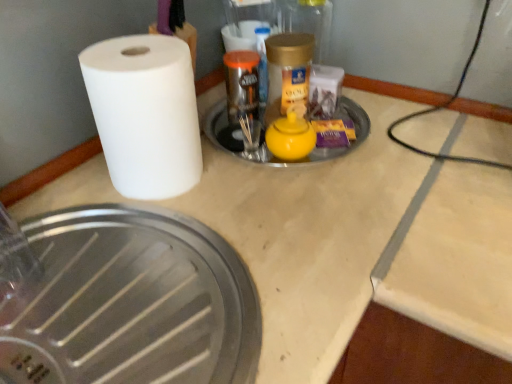
Question: Considering the relative sizes of yellow matte teapot at center, which appears as the 2th manhole cover when ordered from the bottom, and brushed metal manhole cover at lower left, the 2th manhole cover viewed from the top, in the image provided, is yellow matte teapot at center, which appears as the 2th manhole cover when ordered from the bottom, thinner than brushed metal manhole cover at lower left, the 2th manhole cover viewed from the top,?

Choices:
 (A) yes
 (B) no

Answer: (A)

Question: Is yellow matte teapot at center, the first manhole cover from the top, not within brushed metal manhole cover at lower left, the 2th manhole cover viewed from the top?

Choices:
 (A) no
 (B) yes

Answer: (B)

Question: From a real-world perspective, is yellow matte teapot at center, which appears as the 2th manhole cover when ordered from the bottom, below brushed metal manhole cover at lower left, the 2th manhole cover viewed from the top?

Choices:
 (A) yes
 (B) no

Answer: (B)

Question: Does yellow matte teapot at center, the first manhole cover from the top, turn towards brushed metal manhole cover at lower left, which is counted as the 1th manhole cover, starting from the bottom?

Choices:
 (A) no
 (B) yes

Answer: (A)

Question: Does yellow matte teapot at center, which appears as the 2th manhole cover when ordered from the bottom, appear on the right side of brushed metal manhole cover at lower left, which is counted as the 1th manhole cover, starting from the bottom?

Choices:
 (A) no
 (B) yes

Answer: (B)

Question: Is brushed metal manhole cover at lower left, the 2th manhole cover viewed from the top, inside or outside of white matte paper towel at left?

Choices:
 (A) inside
 (B) outside

Answer: (B)

Question: Considering the positions of point (159, 226) and point (182, 150), is point (159, 226) closer or farther from the camera than point (182, 150)?

Choices:
 (A) closer
 (B) farther

Answer: (A)

Question: In the image, is brushed metal manhole cover at lower left, which is counted as the 1th manhole cover, starting from the bottom, positioned in front of or behind white matte paper towel at left?

Choices:
 (A) behind
 (B) front

Answer: (B)

Question: From a real-world perspective, is brushed metal manhole cover at lower left, the 2th manhole cover viewed from the top, above or below white matte paper towel at left?

Choices:
 (A) below
 (B) above

Answer: (A)

Question: Is white matte paper towel at left wider or thinner than brushed metal manhole cover at lower left, which is counted as the 1th manhole cover, starting from the bottom?

Choices:
 (A) thin
 (B) wide

Answer: (A)

Question: Relative to brushed metal manhole cover at lower left, the 2th manhole cover viewed from the top, is white matte paper towel at left in front or behind?

Choices:
 (A) behind
 (B) front

Answer: (A)

Question: From a real-world perspective, is white matte paper towel at left physically located above or below brushed metal manhole cover at lower left, the 2th manhole cover viewed from the top?

Choices:
 (A) above
 (B) below

Answer: (A)

Question: In the image, is white matte paper towel at left on the left side or the right side of brushed metal manhole cover at lower left, the 2th manhole cover viewed from the top?

Choices:
 (A) right
 (B) left

Answer: (A)

Question: In terms of height, does brushed metal manhole cover at lower left, the 2th manhole cover viewed from the top, look taller or shorter compared to yellow matte teapot at center, the first manhole cover from the top?

Choices:
 (A) short
 (B) tall

Answer: (B)

Question: Is brushed metal manhole cover at lower left, the 2th manhole cover viewed from the top, inside or outside of yellow matte teapot at center, which appears as the 2th manhole cover when ordered from the bottom?

Choices:
 (A) outside
 (B) inside

Answer: (A)